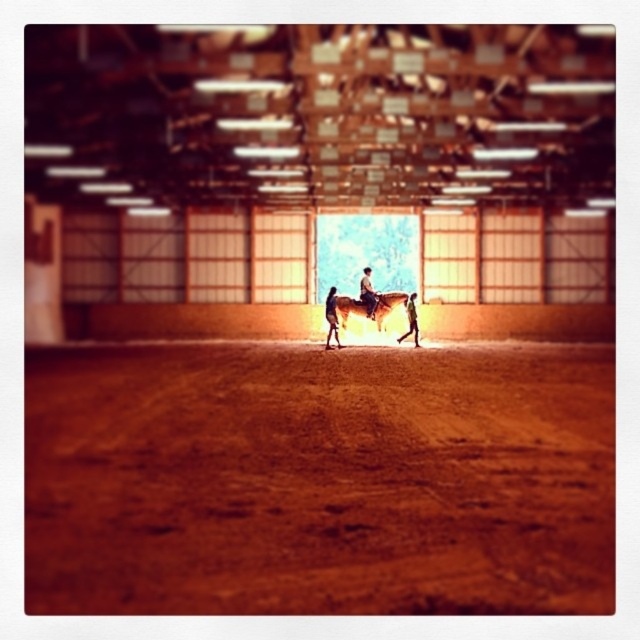
Question: Among these objects, which one is nearest to the camera?

Choices:
 (A) brown textured dirt track at center
 (B) light brown leather jacket at center
 (C) brown leather horse at center

Answer: (A)

Question: Where is brown leather horse at center located in relation to light brown leather jacket at center in the image?

Choices:
 (A) right
 (B) left

Answer: (B)

Question: Which point appears farthest from the camera in this image?

Choices:
 (A) (218, 349)
 (B) (362, 282)

Answer: (B)

Question: Can you confirm if brown textured dirt track at center is thinner than smooth brown horse at center?

Choices:
 (A) yes
 (B) no

Answer: (B)

Question: Which of the following is the farthest from the observer?

Choices:
 (A) smooth brown horse at center
 (B) light brown leather jacket at center
 (C) brown textured dirt track at center

Answer: (B)

Question: Can you confirm if brown leather horse at center is positioned above light brown leather jacket at center?

Choices:
 (A) no
 (B) yes

Answer: (B)